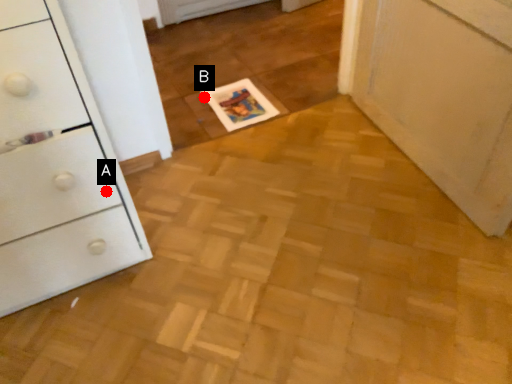
Question: Two points are circled on the image, labeled by A and B beside each circle. Among these points, which one is farthest from the camera?

Choices:
 (A) A is further
 (B) B is further

Answer: (B)